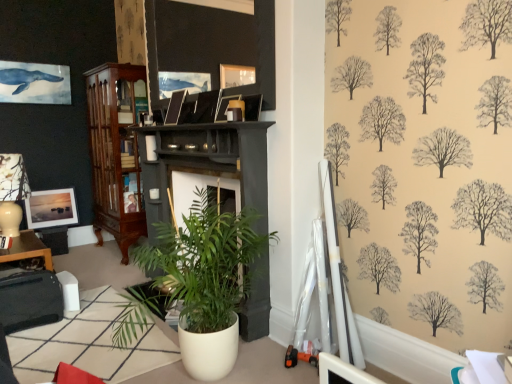
Question: Is white glossy table at lower left, which is the second table from back to front, at the left side of matte white picture frame at lower left, which is the 1th picture frame in back-to-front order?

Choices:
 (A) yes
 (B) no

Answer: (B)

Question: Is white glossy table at lower left, which ranks as the second table in top-to-bottom order, bigger than matte white picture frame at lower left, which is the 1th picture frame from bottom to top?

Choices:
 (A) yes
 (B) no

Answer: (A)

Question: Is white glossy table at lower left, acting as the 1th table starting from the front, positioned behind matte white picture frame at lower left, acting as the third picture frame starting from the top?

Choices:
 (A) no
 (B) yes

Answer: (A)

Question: From a real-world perspective, is white glossy table at lower left, acting as the 1th table starting from the front, under matte white picture frame at lower left, acting as the third picture frame starting from the top?

Choices:
 (A) yes
 (B) no

Answer: (A)

Question: From the image's perspective, is white glossy table at lower left, acting as the 1th table starting from the front, on top of matte white picture frame at lower left, arranged as the 3th picture frame when viewed from the right?

Choices:
 (A) yes
 (B) no

Answer: (B)

Question: Is white glossy table at lower left, which is the 1th table from bottom to top, positioned beyond the bounds of matte white picture frame at lower left, which is the 1th picture frame from bottom to top?

Choices:
 (A) no
 (B) yes

Answer: (B)

Question: Can you confirm if mahogany wood cabinet at left is positioned to the left of white glossy table at lower left, acting as the 1th table starting from the front?

Choices:
 (A) no
 (B) yes

Answer: (B)

Question: From a real-world perspective, is mahogany wood cabinet at left located higher than white glossy table at lower left, acting as the 1th table starting from the front?

Choices:
 (A) no
 (B) yes

Answer: (B)

Question: Is mahogany wood cabinet at left next to white glossy table at lower left, which is the second table from back to front?

Choices:
 (A) no
 (B) yes

Answer: (A)

Question: From the image's perspective, is mahogany wood cabinet at left under white glossy table at lower left, which ranks as the second table in top-to-bottom order?

Choices:
 (A) no
 (B) yes

Answer: (A)

Question: Does mahogany wood cabinet at left have a greater width compared to white glossy table at lower left, which appears as the 1th table when viewed from the right?

Choices:
 (A) yes
 (B) no

Answer: (B)

Question: Does mahogany wood cabinet at left have a greater height compared to white glossy table at lower left, placed as the 2th table when sorted from left to right?

Choices:
 (A) no
 (B) yes

Answer: (B)

Question: Is matte black lampshade at left closer to camera compared to white glossy table at lower left, arranged as the 2th table when viewed from the right?

Choices:
 (A) no
 (B) yes

Answer: (B)